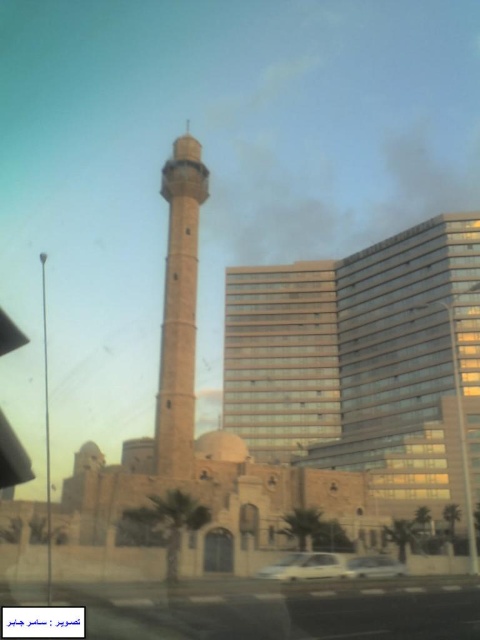
You are standing at the base of the minaret and want to take a photo of both the minaret and the modern high rises. If you position yourself so that the two points, point (172, 230) and point (381, 568), are visible in your camera frame, which point should be closer to the camera?

Point (381, 568) is closer to the camera because the description states that point (172, 230) is behind point (381, 568).